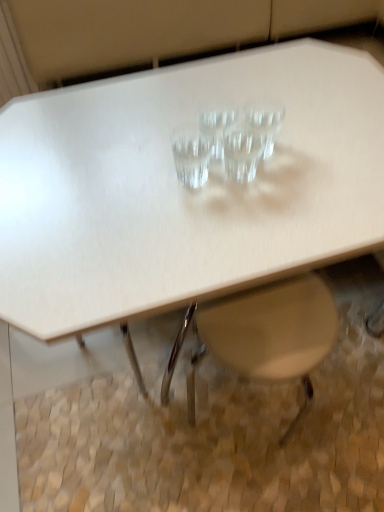
Image resolution: width=384 pixels, height=512 pixels. I want to click on free space in front of transparent glass martini glass at center, placed as the third martini glass when sorted from right to left, so click(217, 219).